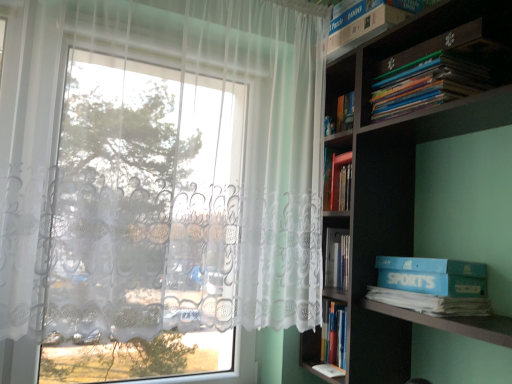
Question: Can you confirm if blue cardboard box at right is wider than dark wood bookcase at right?

Choices:
 (A) no
 (B) yes

Answer: (A)

Question: Are blue cardboard box at right and dark wood bookcase at right located far from each other?

Choices:
 (A) yes
 (B) no

Answer: (B)

Question: Is blue cardboard box at right aimed at dark wood bookcase at right?

Choices:
 (A) yes
 (B) no

Answer: (A)

Question: Is blue cardboard box at right thinner than dark wood bookcase at right?

Choices:
 (A) no
 (B) yes

Answer: (B)

Question: Considering the relative sizes of blue cardboard box at right and dark wood bookcase at right in the image provided, is blue cardboard box at right shorter than dark wood bookcase at right?

Choices:
 (A) no
 (B) yes

Answer: (B)

Question: Is blue cardboard box at right looking in the opposite direction of dark wood bookcase at right?

Choices:
 (A) yes
 (B) no

Answer: (A)

Question: From the image's perspective, is white cardboard box at upper right, which appears as the 2th book when ordered from the bottom, below white lace curtain at left?

Choices:
 (A) yes
 (B) no

Answer: (B)

Question: Does white cardboard box at upper right, which is counted as the 1th book, starting from the top, lie behind white lace curtain at left?

Choices:
 (A) no
 (B) yes

Answer: (B)

Question: Can you confirm if white cardboard box at upper right, which is counted as the 1th book, starting from the top, is shorter than white lace curtain at left?

Choices:
 (A) yes
 (B) no

Answer: (A)

Question: Is white cardboard box at upper right, which is counted as the 1th book, starting from the top, facing towards white lace curtain at left?

Choices:
 (A) yes
 (B) no

Answer: (B)

Question: From a real-world perspective, does white cardboard box at upper right, which is counted as the 1th book, starting from the top, sit lower than white lace curtain at left?

Choices:
 (A) no
 (B) yes

Answer: (A)

Question: Considering the relative sizes of white cardboard box at upper right, which appears as the 2th book when ordered from the bottom, and white lace curtain at left in the image provided, is white cardboard box at upper right, which appears as the 2th book when ordered from the bottom, bigger than white lace curtain at left?

Choices:
 (A) yes
 (B) no

Answer: (B)

Question: From the image's perspective, would you say white lace curtain at left is positioned over blue cardboard box at right?

Choices:
 (A) no
 (B) yes

Answer: (B)